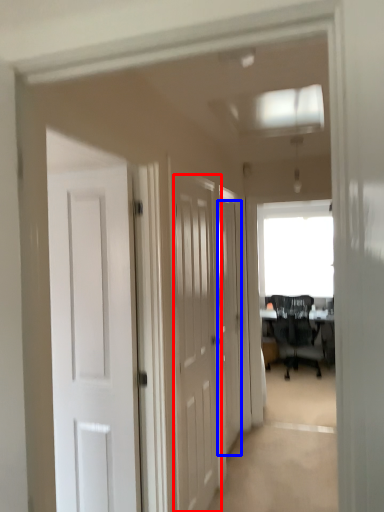
Question: Which point is further to the camera, door (highlighted by a red box) or door (highlighted by a blue box)?

Choices:
 (A) door
 (B) door

Answer: (B)